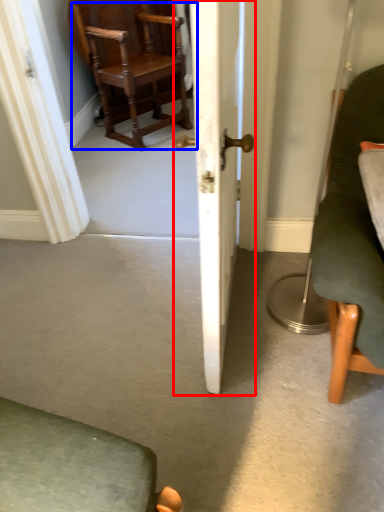
Question: Which object is further to the camera taking this photo, door (highlighted by a red box) or chair (highlighted by a blue box)?

Choices:
 (A) door
 (B) chair

Answer: (B)